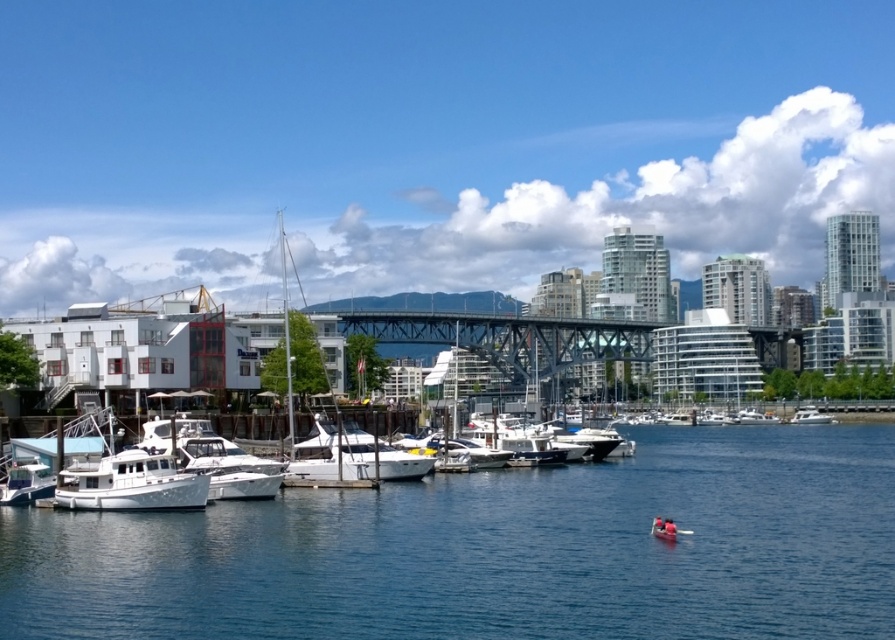
Question: Is white glossy boat at center thinner than white matte boat at center?

Choices:
 (A) no
 (B) yes

Answer: (A)

Question: Which object appears farthest from the camera in this image?

Choices:
 (A) white glossy boat at center
 (B) white matte boat at center
 (C) clear blue water at center

Answer: (B)

Question: Where is clear blue water at center located in relation to white glossy boat at center in the image?

Choices:
 (A) left
 (B) right

Answer: (B)

Question: Among these points, which one is nearest to the camera?

Choices:
 (A) (815, 419)
 (B) (857, 602)

Answer: (B)

Question: Can you confirm if white glossy boat at center is positioned above white matte boat at center?

Choices:
 (A) yes
 (B) no

Answer: (A)

Question: Which of the following is the closest to the observer?

Choices:
 (A) (813, 419)
 (B) (124, 573)

Answer: (B)